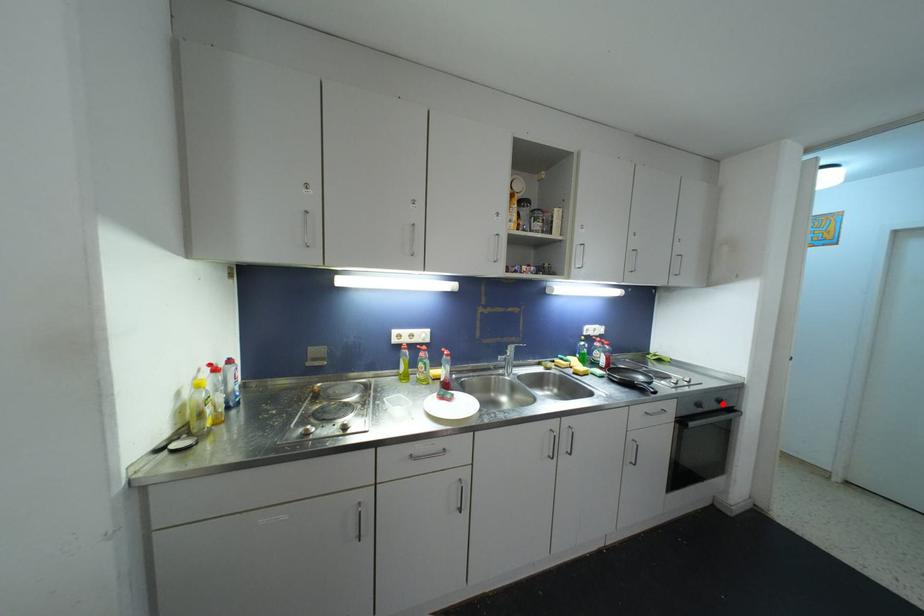
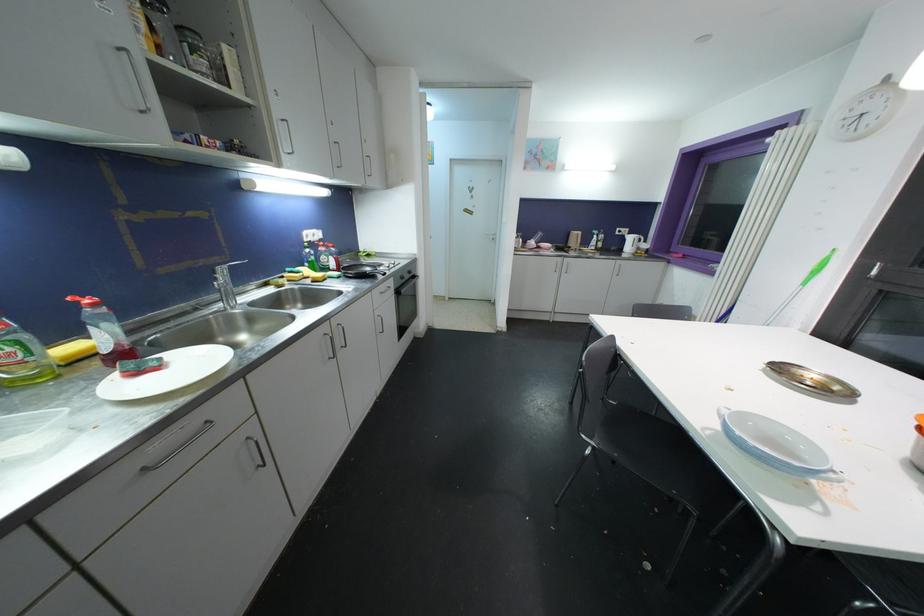
Question: I am providing you with two images of the same scene from different viewpoints. A red point is marked on the first image. Can you still see the location of the red point in image 2?

Choices:
 (A) Yes
 (B) No

Answer: (A)